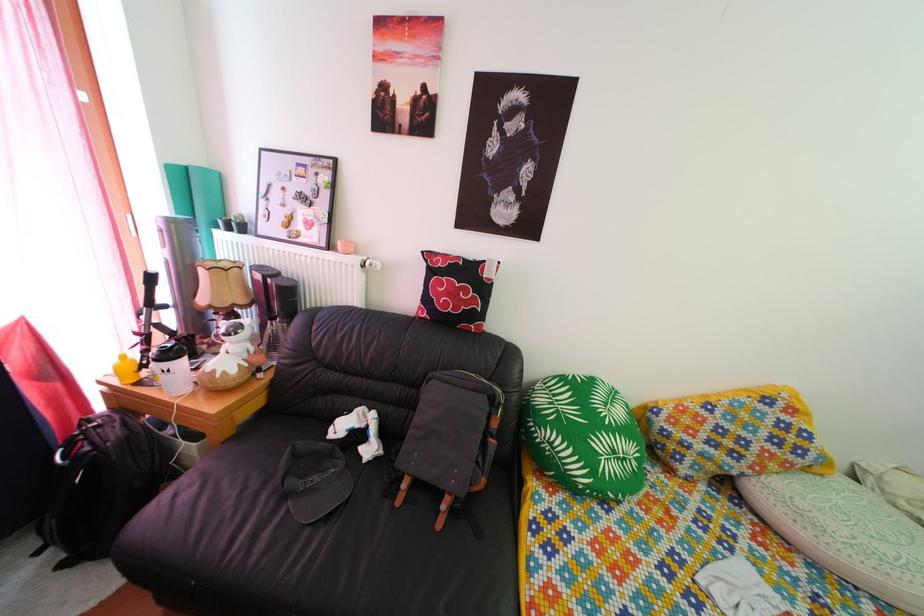
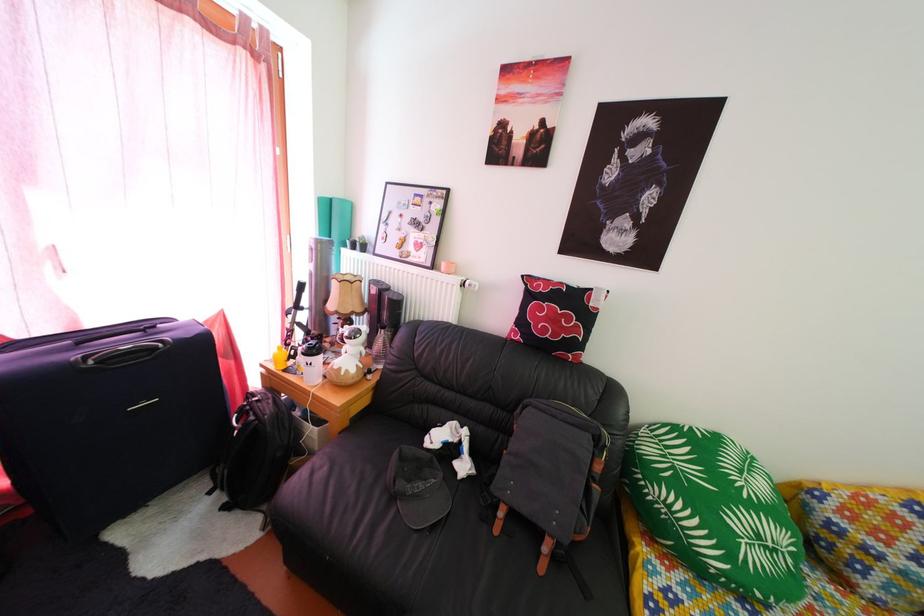
Find the pixel in the second image that matches [460,301] in the first image.

(562, 328)